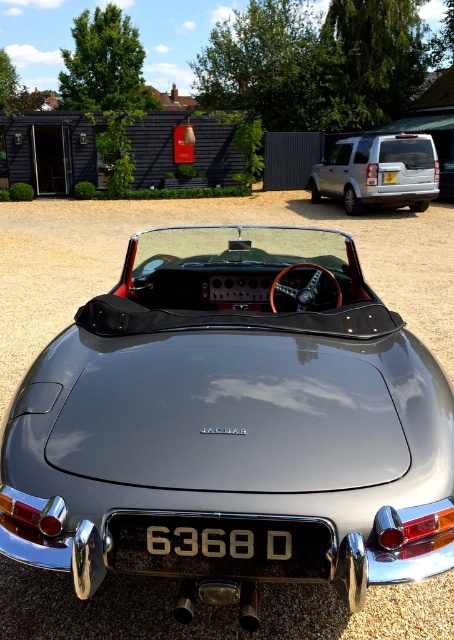
Does shiny metallic sports car at center appear under silver metallic license plate at center?

Yes, shiny metallic sports car at center is below silver metallic license plate at center.

Find the location of a particular element. This screenshot has height=640, width=454. shiny metallic sports car at center is located at coordinates (232, 426).

Between shiny metallic sports car at center and silver metallic suv at upper right, which one is positioned lower?

shiny metallic sports car at center is below.

Is shiny metallic sports car at center below silver metallic suv at upper right?

Indeed, shiny metallic sports car at center is positioned under silver metallic suv at upper right.

Is point (24, 508) farther from viewer compared to point (335, 145)?

That is False.

The height and width of the screenshot is (640, 454). Find the location of `shiny metallic sports car at center`. shiny metallic sports car at center is located at coordinates (232, 426).

What do you see at coordinates (378, 172) in the screenshot? I see `silver metallic suv at upper right` at bounding box center [378, 172].

Does silver metallic suv at upper right have a lesser width compared to silver metallic license plate at center?

No, silver metallic suv at upper right is not thinner than silver metallic license plate at center.

Identify the location of silver metallic suv at upper right. (378, 172).